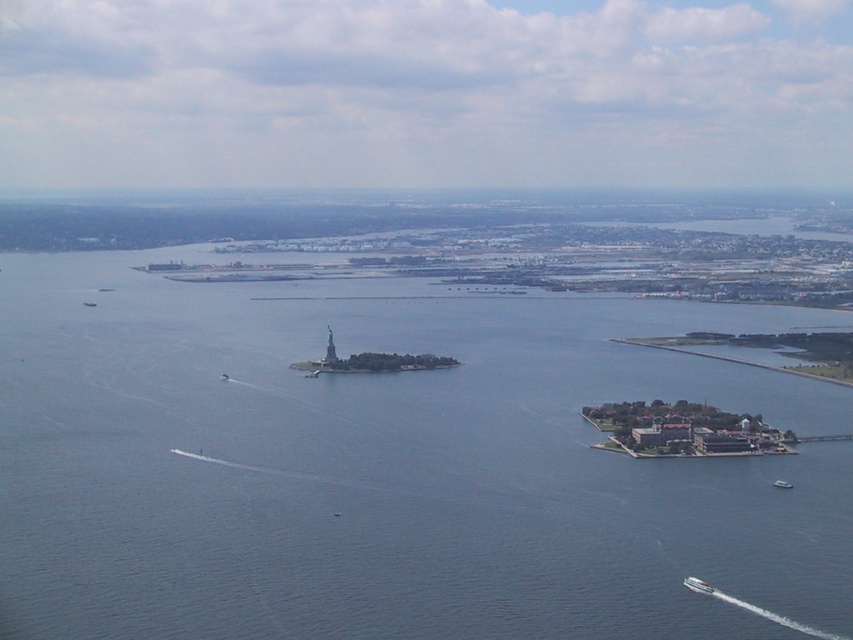
Question: Is white glossy boat at lower right below white plastic boat at lower right?

Choices:
 (A) yes
 (B) no

Answer: (A)

Question: Estimate the real-world distances between objects in this image. Which object is closer to the white plastic boat at lower right?

Choices:
 (A) white glossy boat at lower right
 (B) blue water at center

Answer: (A)

Question: Can you confirm if blue water at center is positioned to the right of white plastic boat at lower right?

Choices:
 (A) no
 (B) yes

Answer: (A)

Question: Which object appears closest to the camera in this image?

Choices:
 (A) white glossy boat at lower right
 (B) white plastic boat at lower right

Answer: (A)

Question: Is blue water at center smaller than white glossy boat at lower right?

Choices:
 (A) yes
 (B) no

Answer: (B)

Question: Which of the following is the farthest from the observer?

Choices:
 (A) white plastic boat at lower right
 (B) white glossy boat at lower right

Answer: (A)